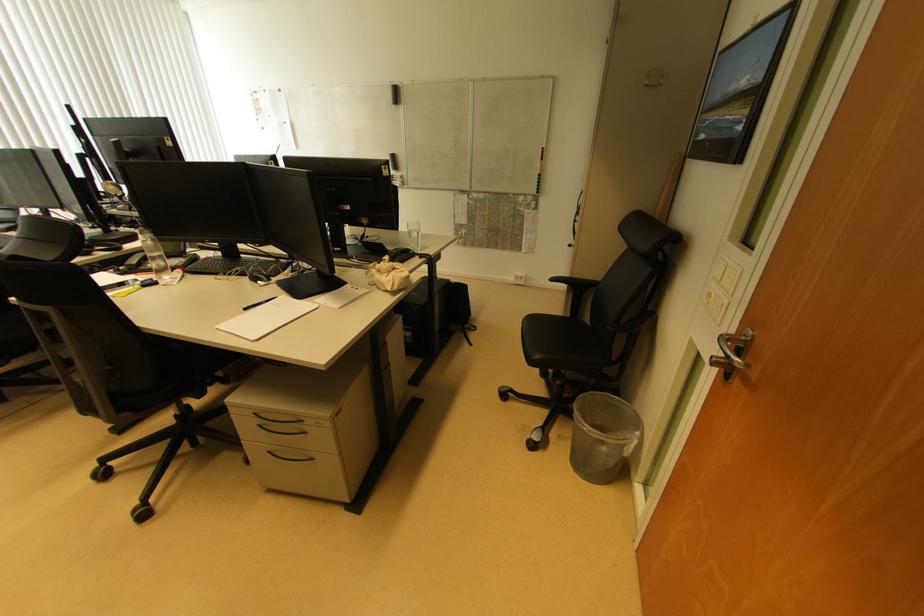
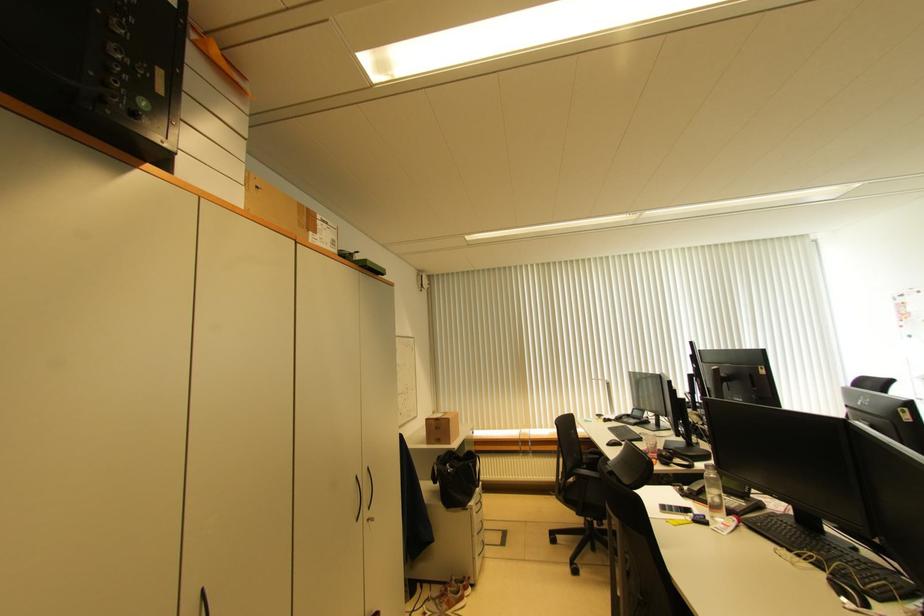
Question: The first image is from the beginning of the video and the second image is from the end. How did the camera likely rotate when shooting the video?

Choices:
 (A) Left
 (B) Right
 (C) Up
 (D) Down

Answer: (A)